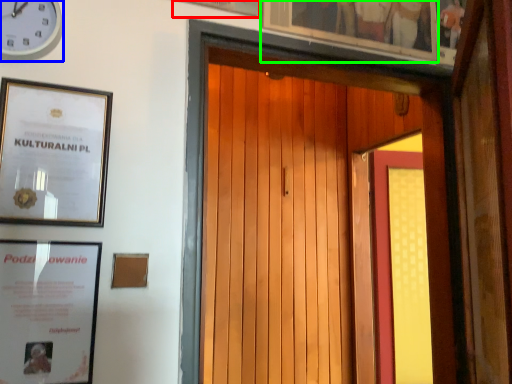
Question: Considering the real-world distances, which object is farthest from picture frame (highlighted by a red box)? clock (highlighted by a blue box) or picture frame (highlighted by a green box)?

Choices:
 (A) clock
 (B) picture frame

Answer: (A)